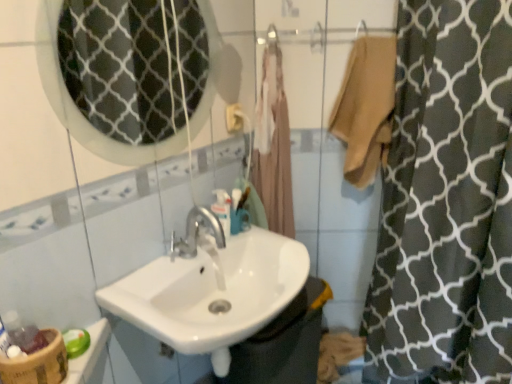
Image resolution: width=512 pixels, height=384 pixels. Describe the element at coordinates (273, 146) in the screenshot. I see `beige fabric bathrobe at center` at that location.

What do you see at coordinates (121, 67) in the screenshot? I see `white glossy mirror at upper center` at bounding box center [121, 67].

At what (x,y) coordinates should I click in order to perform the action: click on white glossy mirror at upper center. Please return your answer as a coordinate pair (x, y). The height and width of the screenshot is (384, 512). Looking at the image, I should click on (121, 67).

What is the approximate width of bamboo textured basket at lower left?

bamboo textured basket at lower left is 12.24 centimeters in width.

The height and width of the screenshot is (384, 512). Find the location of `beige fabric bathrobe at center`. beige fabric bathrobe at center is located at coordinates (273, 146).

From the image's perspective, relative to beige cotton towel at upper right, is bamboo textured basket at lower left above or below?

From the image's perspective, bamboo textured basket at lower left appears below beige cotton towel at upper right.

Which object is wider, bamboo textured basket at lower left or beige cotton towel at upper right?

With larger width is beige cotton towel at upper right.

Measure the distance from bamboo textured basket at lower left to beige cotton towel at upper right.

bamboo textured basket at lower left is 1.20 meters from beige cotton towel at upper right.

Is bamboo textured basket at lower left outside of beige cotton towel at upper right?

Indeed, bamboo textured basket at lower left is completely outside beige cotton towel at upper right.

From the image's perspective, relative to white glossy sink at center, is beige fabric bathrobe at center above or below?

beige fabric bathrobe at center is above white glossy sink at center.

Can you confirm if beige fabric bathrobe at center is positioned to the right of white glossy sink at center?

Indeed, beige fabric bathrobe at center is positioned on the right side of white glossy sink at center.

Between beige fabric bathrobe at center and white glossy sink at center, which one has smaller size?

Smaller between the two is beige fabric bathrobe at center.

Based on the photo, is beige fabric bathrobe at center taller than white glossy sink at center?

Yes, beige fabric bathrobe at center is taller than white glossy sink at center.

Measure the distance between translucent plastic mouthwash at center and beige fabric bathrobe at center.

The distance of translucent plastic mouthwash at center from beige fabric bathrobe at center is 28.01 centimeters.

From the picture: Between translucent plastic mouthwash at center and beige fabric bathrobe at center, which one appears on the left side from the viewer's perspective?

translucent plastic mouthwash at center is more to the left.

Would you consider translucent plastic mouthwash at center to be distant from beige fabric bathrobe at center?

translucent plastic mouthwash at center is actually quite close to beige fabric bathrobe at center.

In terms of width, does translucent plastic mouthwash at center look wider or thinner when compared to beige fabric bathrobe at center?

In the image, translucent plastic mouthwash at center appears to be more narrow than beige fabric bathrobe at center.

Does bamboo textured basket at lower left have a greater height compared to beige fabric bathrobe at center?

In fact, bamboo textured basket at lower left may be shorter than beige fabric bathrobe at center.

From a real-world perspective, is bamboo textured basket at lower left positioned above or below beige fabric bathrobe at center?

From a real-world perspective, bamboo textured basket at lower left is physically below beige fabric bathrobe at center.

In order to click on bathrobe that appears above the bamboo textured basket at lower left (from the image's perspective) in this screenshot , I will do `click(273, 146)`.

Between point (359, 159) and point (279, 125), which one is positioned in front?

Positioned in front is point (359, 159).

From the image's perspective, which one is positioned higher, beige cotton towel at upper right or beige fabric bathrobe at center?

beige cotton towel at upper right is shown above in the image.

Does beige cotton towel at upper right have a greater width compared to beige fabric bathrobe at center?

Indeed, beige cotton towel at upper right has a greater width compared to beige fabric bathrobe at center.

Which of these two, white glossy sink at center or white glossy mirror at upper center, is smaller?

With smaller size is white glossy mirror at upper center.

In the image, is white glossy sink at center positioned in front of or behind white glossy mirror at upper center?

white glossy sink at center is positioned farther from the viewer than white glossy mirror at upper center.

Based on the photo, from a real-world perspective, between white glossy sink at center and white glossy mirror at upper center, who is vertically higher?

In real-world perspective, white glossy mirror at upper center is above.

How much distance is there between white glossy sink at center and white glossy mirror at upper center?

white glossy sink at center is 32.59 inches away from white glossy mirror at upper center.

Is white glossy sink at center in front of or behind beige fabric bathrobe at center in the image?

Clearly, white glossy sink at center is in front of beige fabric bathrobe at center.

From a real-world perspective, is white glossy sink at center located higher than beige fabric bathrobe at center?

No, from a real-world perspective, white glossy sink at center is not above beige fabric bathrobe at center.

How different are the orientations of white glossy sink at center and beige fabric bathrobe at center in degrees?

The angle between the facing direction of white glossy sink at center and the facing direction of beige fabric bathrobe at center is 55.7 degrees.

I want to click on bath towel above the bamboo textured basket at lower left (from the image's perspective), so click(366, 108).

This screenshot has height=384, width=512. Identify the location of bathrobe that is on the right side of white glossy sink at center. (273, 146).

Considering their positions, is beige cotton towel at upper right positioned further to bamboo textured basket at lower left than white glossy sink at center?

The object further to bamboo textured basket at lower left is beige cotton towel at upper right.

Based on their spatial positions, is beige cotton towel at upper right or translucent plastic mouthwash at center closer to beige fabric bathrobe at center?

translucent plastic mouthwash at center is closer to beige fabric bathrobe at center.

Looking at the image, which one is located closer to white glossy mirror at upper center, bamboo textured basket at lower left or beige fabric bathrobe at center?

beige fabric bathrobe at center.

Which object lies nearer to the anchor point white glossy mirror at upper center, translucent plastic mouthwash at center or beige cotton towel at upper right?

translucent plastic mouthwash at center is closer to white glossy mirror at upper center.

Estimate the real-world distances between objects in this image. Which object is further from translucent plastic mouthwash at center, white glossy mirror at upper center or white glossy sink at center?

white glossy mirror at upper center is further to translucent plastic mouthwash at center.

Looking at the image, which one is located closer to beige cotton towel at upper right, white glossy mirror at upper center or translucent plastic mouthwash at center?

translucent plastic mouthwash at center.

Estimate the real-world distances between objects in this image. Which object is closer to beige fabric bathrobe at center, bamboo textured basket at lower left or white glossy sink at center?

white glossy sink at center is closer to beige fabric bathrobe at center.

Estimate the real-world distances between objects in this image. Which object is further from white glossy mirror at upper center, white glossy sink at center or beige cotton towel at upper right?

Based on the image, beige cotton towel at upper right appears to be further to white glossy mirror at upper center.

The width and height of the screenshot is (512, 384). What are the coordinates of `bathrobe between translucent plastic mouthwash at center and beige cotton towel at upper right` in the screenshot? It's located at (273, 146).

Locate an element on the screen. sink located between bamboo textured basket at lower left and translucent plastic mouthwash at center in the depth direction is located at coordinates (211, 289).

You are a GUI agent. You are given a task and a screenshot of the screen. Output one action in this format:
    pyautogui.click(x=<x>, y=<y>)
    Task: Click on the mouthwash between beige cotton towel at upper right and white glossy sink at center in the vertical direction
    The image size is (512, 384).
    Given the screenshot: What is the action you would take?
    pyautogui.click(x=222, y=209)

I want to click on mouthwash between white glossy mirror at upper center and white glossy sink at center in the up-down direction, so [222, 209].